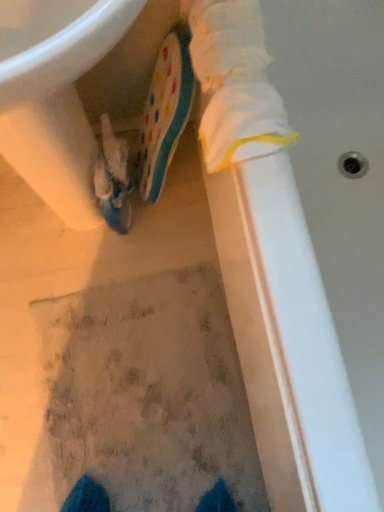
Question: From the image's perspective, is polka dot rubber boot at center, the 2th footwear from the left, above or below textured gray mat at center?

Choices:
 (A) below
 (B) above

Answer: (B)

Question: Based on their positions, is polka dot rubber boot at center, which is counted as the 1th footwear, starting from the right, located to the left or right of textured gray mat at center?

Choices:
 (A) right
 (B) left

Answer: (A)

Question: Which object is positioned farthest from the white glossy sink at upper left?

Choices:
 (A) polka dot rubber boot at center, the 2th footwear from the left
 (B) textured gray mat at center
 (C) matte blue shoe at center, which ranks as the first footwear in left-to-right order

Answer: (B)

Question: Which object is positioned farthest from the matte blue shoe at center, the 2th footwear when ordered from right to left?

Choices:
 (A) white glossy sink at upper left
 (B) polka dot rubber boot at center, which is counted as the 1th footwear, starting from the right
 (C) textured gray mat at center

Answer: (C)